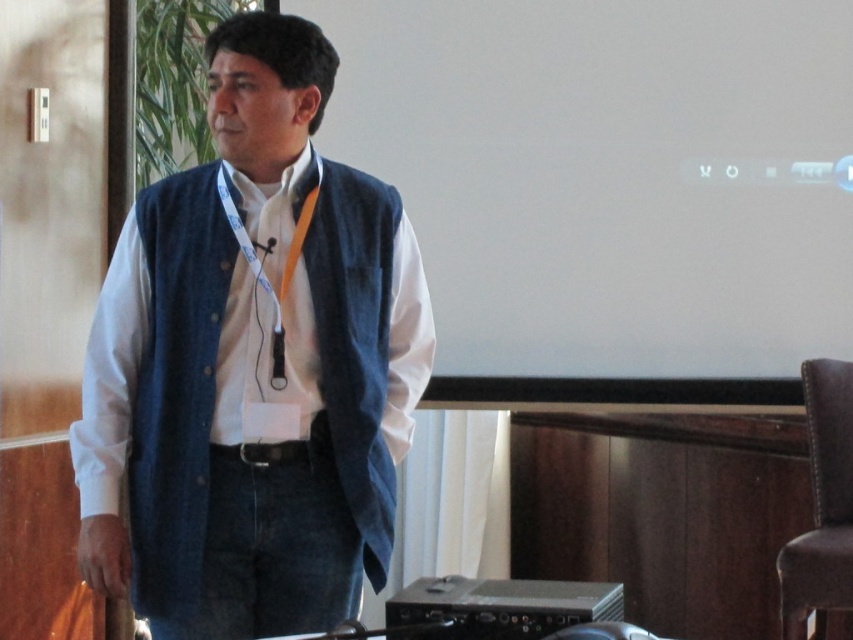
Between point (836, 195) and point (331, 499), which one is positioned behind?

The point (836, 195) is more distant.

Does white matte projection screen at upper center have a smaller size compared to denim vest at center?

Indeed, white matte projection screen at upper center has a smaller size compared to denim vest at center.

Which is in front, point (770, 124) or point (247, 182)?

Point (247, 182)

The width and height of the screenshot is (853, 640). In order to click on white matte projection screen at upper center in this screenshot , I will do point(611,186).